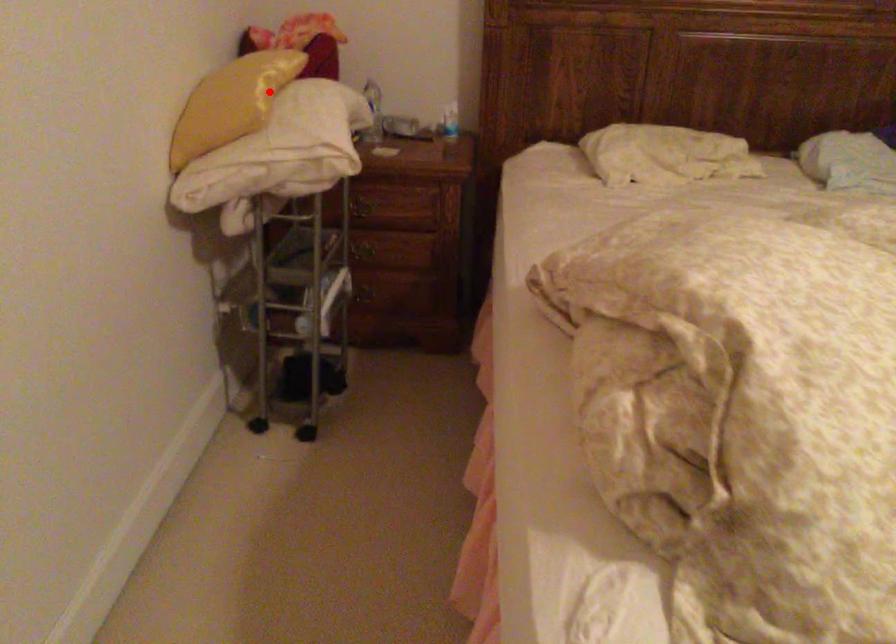
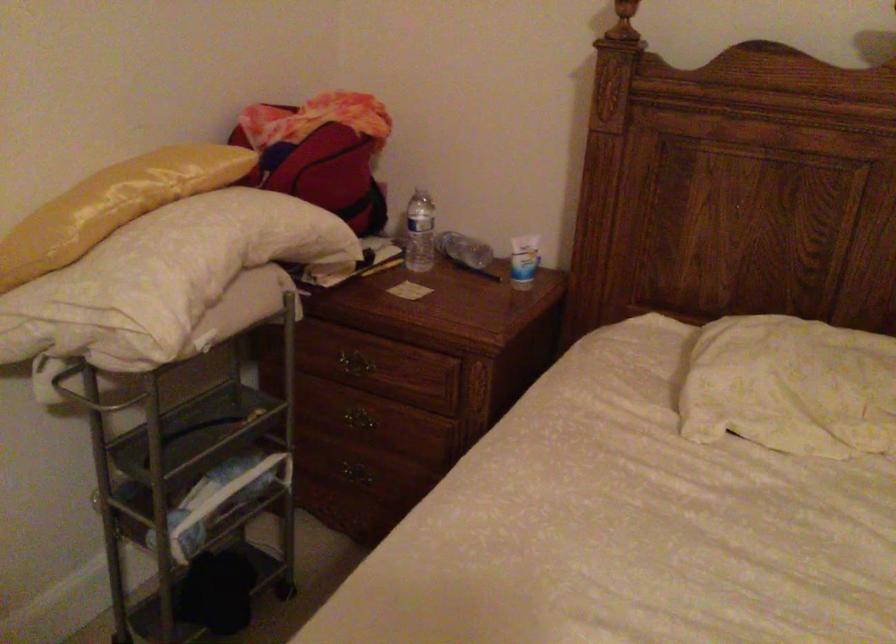
The point at the highlighted location is marked in the first image. Where is the corresponding point in the second image?

(113, 205)